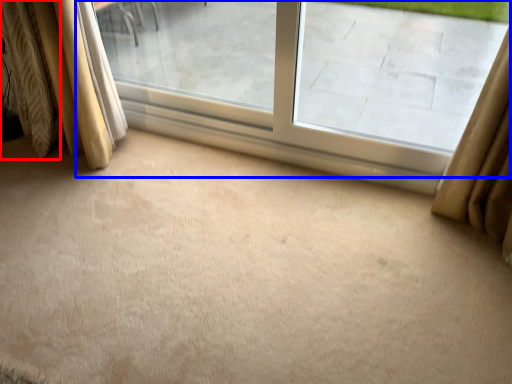
Question: Which point is closer to the camera, curtain (highlighted by a red box) or window (highlighted by a blue box)?

Choices:
 (A) curtain
 (B) window

Answer: (B)